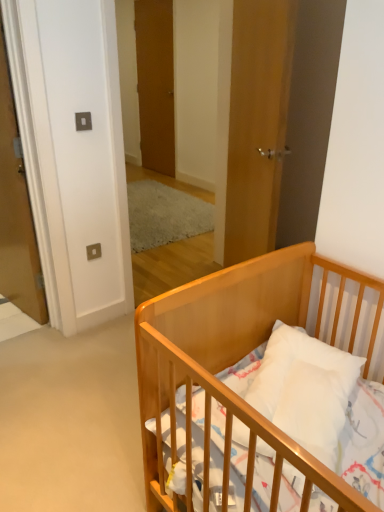
Question: Can you confirm if wooden door at center, which is counted as the 3th door, starting from the back, is shorter than light wood crib at lower right?

Choices:
 (A) no
 (B) yes

Answer: (A)

Question: Is wooden door at center, the third door from the left, at the left side of light wood crib at lower right?

Choices:
 (A) yes
 (B) no

Answer: (A)

Question: Would you say wooden door at center, which is counted as the 3th door, starting from the back, is outside light wood crib at lower right?

Choices:
 (A) yes
 (B) no

Answer: (A)

Question: Considering the relative sizes of wooden door at center, acting as the first door starting from the right, and light wood crib at lower right in the image provided, is wooden door at center, acting as the first door starting from the right, smaller than light wood crib at lower right?

Choices:
 (A) no
 (B) yes

Answer: (B)

Question: Can you confirm if wooden door at center, acting as the first door starting from the right, is thinner than light wood crib at lower right?

Choices:
 (A) yes
 (B) no

Answer: (A)

Question: Is the surface of wooden door at center, positioned as the first door in front-to-back order, in direct contact with light wood crib at lower right?

Choices:
 (A) no
 (B) yes

Answer: (A)

Question: Does light wood crib at lower right have a smaller size compared to wooden door at center, which is the 2th door from right to left?

Choices:
 (A) yes
 (B) no

Answer: (B)

Question: Is wooden door at center, which is the 3th door from front to back, completely or partially inside light wood crib at lower right?

Choices:
 (A) no
 (B) yes

Answer: (A)

Question: From the image's perspective, is light wood crib at lower right above wooden door at center, the second door from the left?

Choices:
 (A) no
 (B) yes

Answer: (A)

Question: Considering the relative positions of light wood crib at lower right and wooden door at center, the second door from the left, in the image provided, is light wood crib at lower right to the left of wooden door at center, the second door from the left, from the viewer's perspective?

Choices:
 (A) no
 (B) yes

Answer: (A)

Question: From the image's perspective, is light wood crib at lower right beneath wooden door at center, the second door from the left?

Choices:
 (A) no
 (B) yes

Answer: (B)

Question: Considering the relative sizes of light wood crib at lower right and wooden door at center, the 1th door when ordered from back to front, in the image provided, is light wood crib at lower right thinner than wooden door at center, the 1th door when ordered from back to front,?

Choices:
 (A) yes
 (B) no

Answer: (B)

Question: Is wooden door at center, acting as the first door starting from the right, outside of wooden door at center, which is the 3th door from front to back?

Choices:
 (A) yes
 (B) no

Answer: (A)